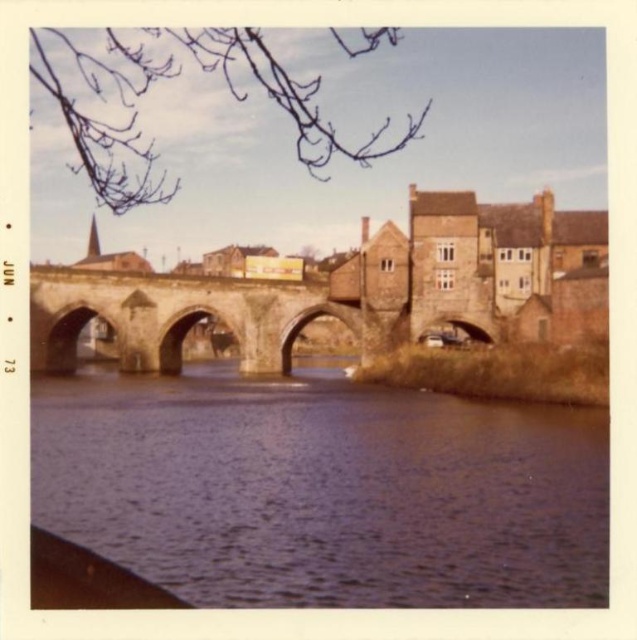
Does brown water at center have a smaller size compared to stone arch bridge at center?

No, brown water at center is not smaller than stone arch bridge at center.

Does point (443, 564) come in front of point (273, 300)?

Yes, it is.

Who is more forward, (241, 381) or (62, 310)?

Positioned in front is point (241, 381).

Where is `brown water at center`? The height and width of the screenshot is (640, 637). brown water at center is located at coordinates point(324,490).